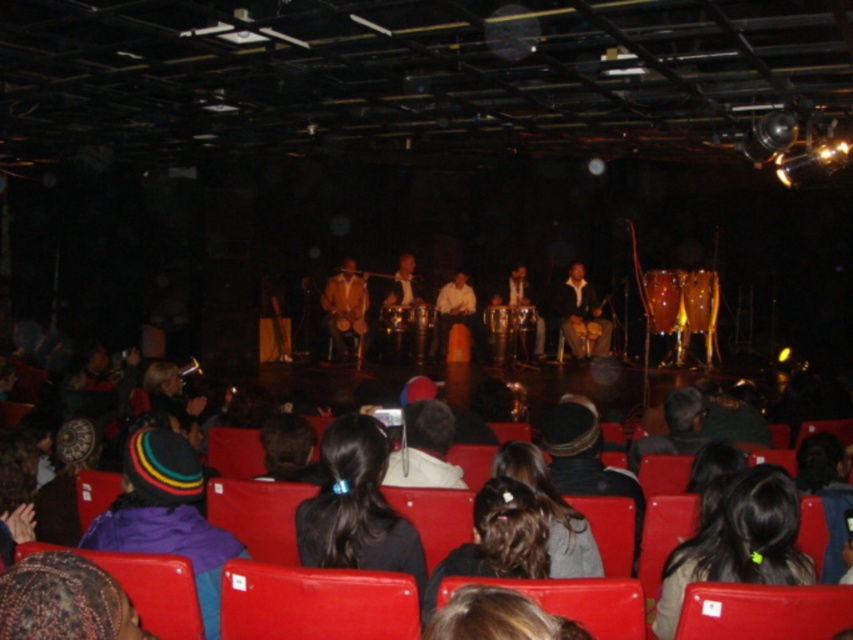
You are standing in the audience of the live music performance and want to move from your current position to a spot closer to the stage. You see two points marked in the image. Which point, point (358, 458) or point (570, 349), is closer to you and would be a better starting point for moving towards the stage?

Point (358, 458) is closer to the viewer than point (570, 349), so it would be a better starting point for moving towards the stage since it is nearer to your current position.

In the live music performance scene, you notice two elements on the stage. One is a person with dark brown hair at lower right and the other is a wooden drum at center. From the perspective of someone sitting in the audience facing the stage, which of these two elements is located to the left of the other?

The dark brown hair at lower right is positioned on the left side of the wooden drum at center, so from the audience perspective facing the stage, the dark brown hair at lower right would be to the left of the wooden drum at center.

You are a photographer at the back of the venue and want to capture a clear shot of the black hair at center and the matte brown drum at center. Which object is narrower so that it won not block the other?

The black hair at center has a lesser width compared to matte brown drum at center, so the black hair at center is narrower and less likely to block the matte brown drum at center.